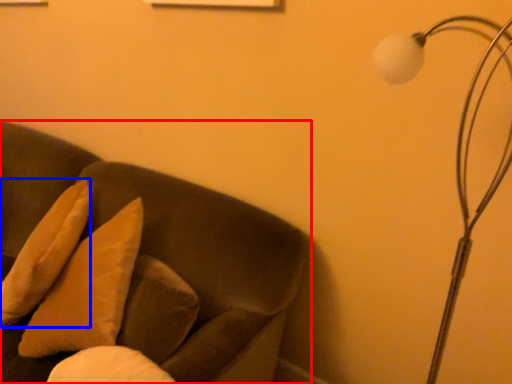
Question: Which of the following is the farthest to the observer, furniture (highlighted by a red box) or pillow (highlighted by a blue box)?

Choices:
 (A) furniture
 (B) pillow

Answer: (B)